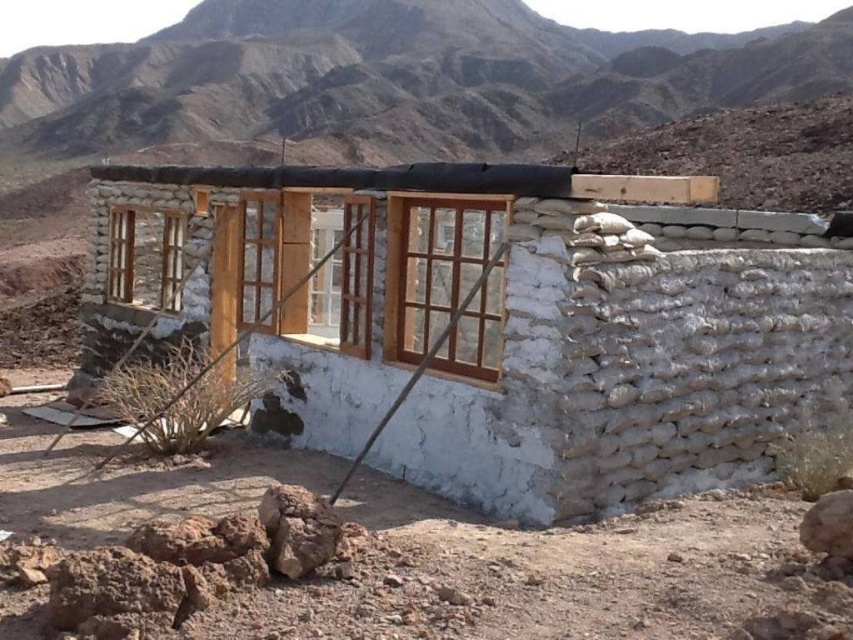
Is white stucco hut at center positioned before wooden frame at left?

No, white stucco hut at center is further to the viewer.

Measure the distance between point (698, 346) and camera.

The distance of point (698, 346) from camera is 5.85 meters.

Does point (648, 301) come in front of point (126, 218)?

Yes, it is in front of point (126, 218).

Where is `white stucco hut at center`? The width and height of the screenshot is (853, 640). white stucco hut at center is located at coordinates (514, 323).

Which of these two, white stucco hut at center or wooden-framed glass window at center, stands shorter?

Standing shorter between the two is white stucco hut at center.

Is white stucco hut at center to the right of wooden-framed glass window at center from the viewer's perspective?

Yes, white stucco hut at center is to the right of wooden-framed glass window at center.

Between point (393, 376) and point (415, 275), which one is positioned in front?

Positioned in front is point (415, 275).

Where is `white stucco hut at center`? The height and width of the screenshot is (640, 853). white stucco hut at center is located at coordinates pos(514,323).

Does brown rocky mountain at upper center appear on the right side of wooden frame at left?

Yes, brown rocky mountain at upper center is to the right of wooden frame at left.

Does brown rocky mountain at upper center have a larger size compared to wooden frame at left?

Indeed, brown rocky mountain at upper center has a larger size compared to wooden frame at left.

Who is more forward, (364, 99) or (132, 268)?

Point (132, 268)

Locate an element on the screen. The height and width of the screenshot is (640, 853). brown rocky mountain at upper center is located at coordinates (398, 77).